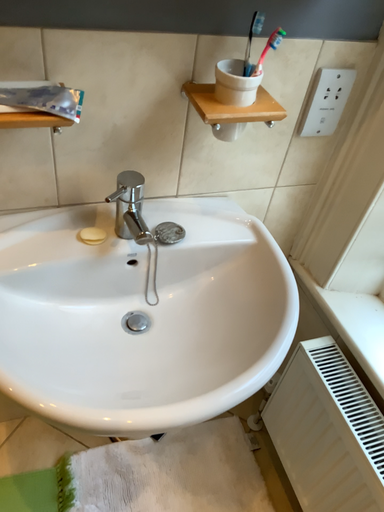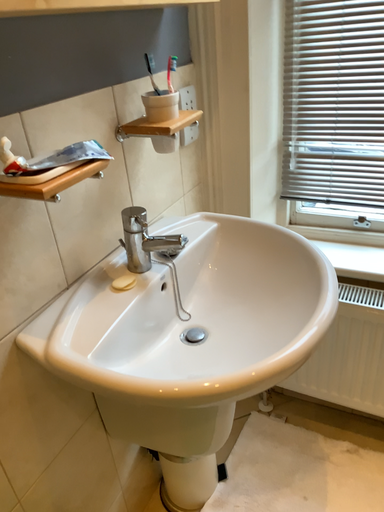
Question: How did the camera likely rotate when shooting the video?

Choices:
 (A) rotated downward
 (B) rotated upward

Answer: (B)